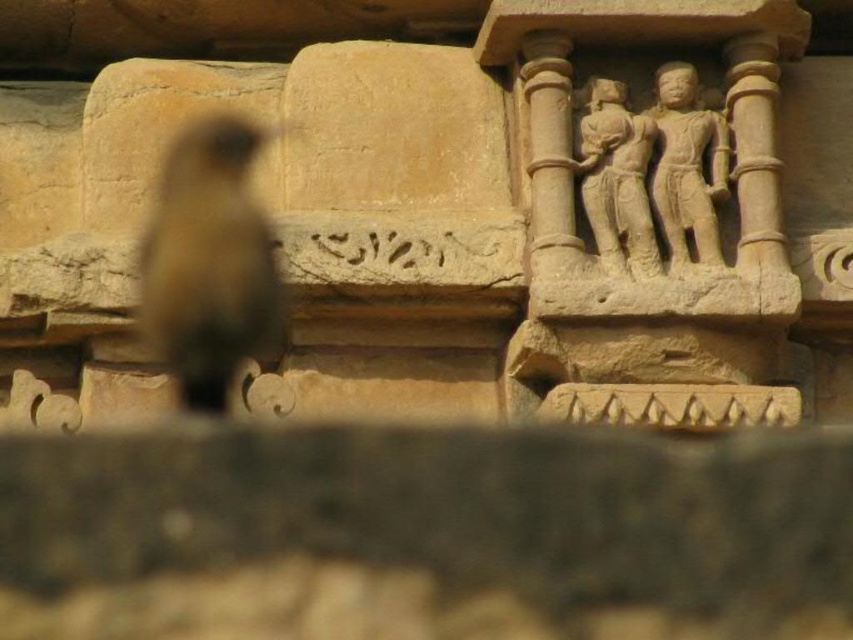
You are an archaeologist examining the ancient stone structure. You notice a brown feathered bird at left and a beige stone statue at upper right. Which object is bigger?

The brown feathered bird at left is larger in size than the beige stone statue at upper right.

You are an archaeologist examining the ancient stone structure. You notice two points marked on the carved relief in the upper right. The first point is at coordinates point (538, 44) and the second is at point (714, 125). Which of these points is nearer to your viewpoint?

Point (538, 44) is closer to the camera than point (714, 125), so the first point is nearer to your viewpoint.

You are an archaeologist examining the ancient stone structure. You notice the brown feathered bird at left and the beige stone statue at upper right. Which object is located below the other?

The brown feathered bird at left is positioned under the beige stone statue at upper right.